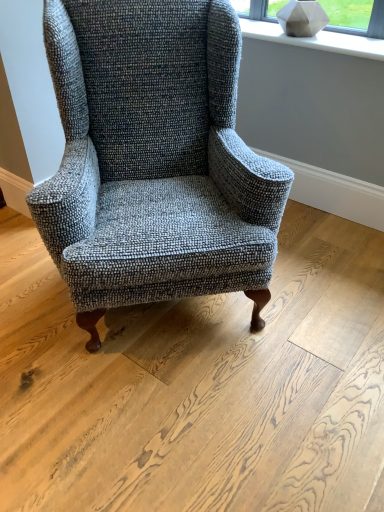
At what (x,y) coordinates should I click in order to perform the action: click on free space in front of textured gray wingback chair at center. Please return your answer as a coordinate pair (x, y). The image size is (384, 512). Looking at the image, I should click on (179, 416).